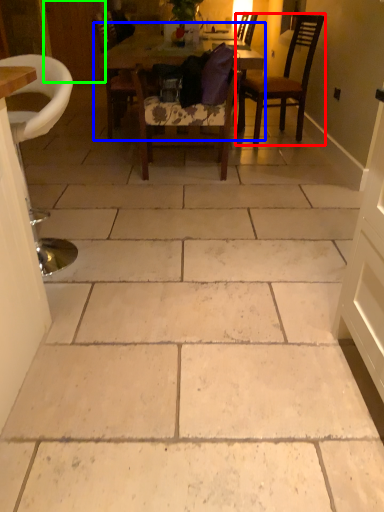
Question: Which object is positioned closest to chair (highlighted by a red box)? Select from kitchen & dining room table (highlighted by a blue box) and door (highlighted by a green box).

Choices:
 (A) kitchen & dining room table
 (B) door

Answer: (A)